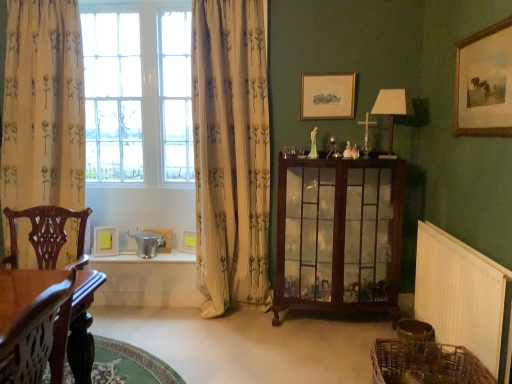
Where is `vacant location below mahogany glass cabinet at center (from a real-world perspective)`? This screenshot has height=384, width=512. vacant location below mahogany glass cabinet at center (from a real-world perspective) is located at coordinates (329, 323).